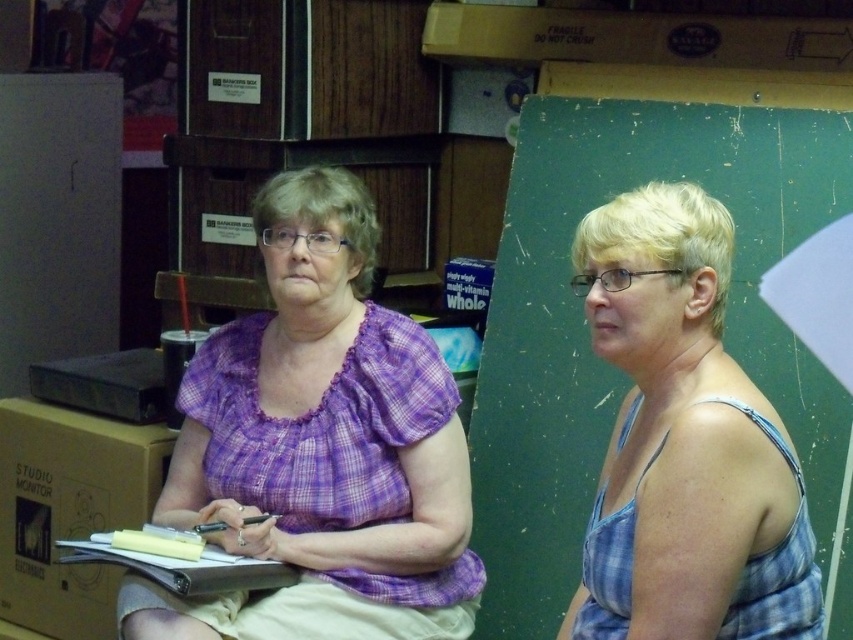
You are organizing a photo shoot and need to ensure that the purple plaid blouse at center and the white paper at center are visible in the frame. Given their sizes, which item will appear larger in the photo?

The purple plaid blouse at center will appear larger in the photo because it has a greater height compared to the white paper at center.

In the scene shown: You are standing in a room where two people are sitting. There is a point marked at coordinates (683, 442). Which person is closest to this point? The person on the left in a purple plaid blouse or the individual on the right in a sleeveless blue and white checkered top?

The blue plaid tank top at right is represented by point (683, 442), so the individual on the right in a sleeveless blue and white checkered top is closest to this point.

You are standing in front of the two people in the image. There is a point marked at coordinates (320, 445). Which object from the list below is this point located on? The options are the purple plaid blouse at center and the green board or wall in the background.

The point at coordinates (320, 445) is located on the purple plaid blouse at center.